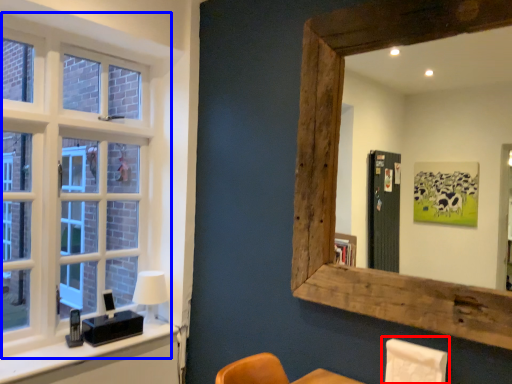
Question: Among these objects, which one is nearest to the camera, swivel chair (highlighted by a red box) or window (highlighted by a blue box)?

Choices:
 (A) swivel chair
 (B) window

Answer: (A)